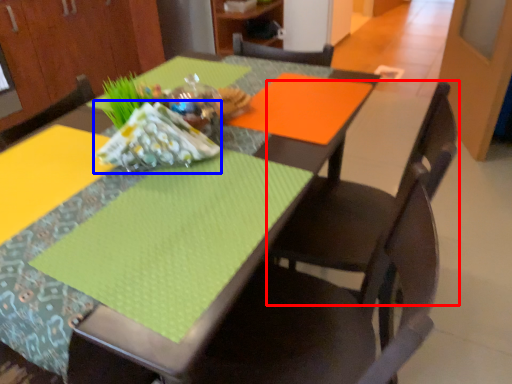
Question: Which object is closer to the camera taking this photo, chair (highlighted by a red box) or material (highlighted by a blue box)?

Choices:
 (A) chair
 (B) material

Answer: (B)